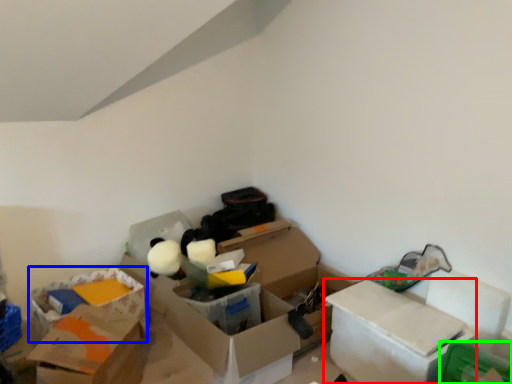
Question: Based on their relative distances, which object is farther from box (highlighted by a red box)? Choose from storage box (highlighted by a blue box) and storage box (highlighted by a green box).

Choices:
 (A) storage box
 (B) storage box

Answer: (A)